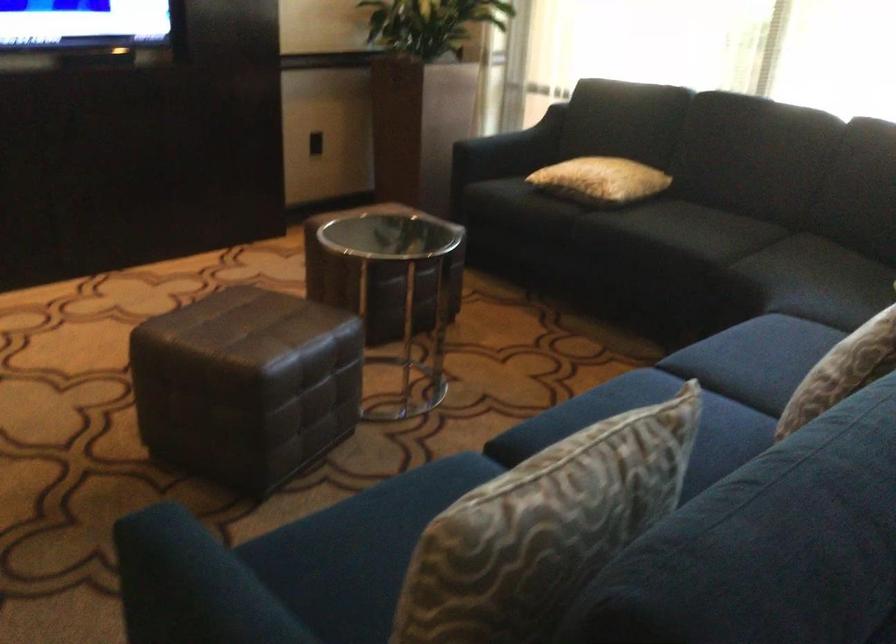
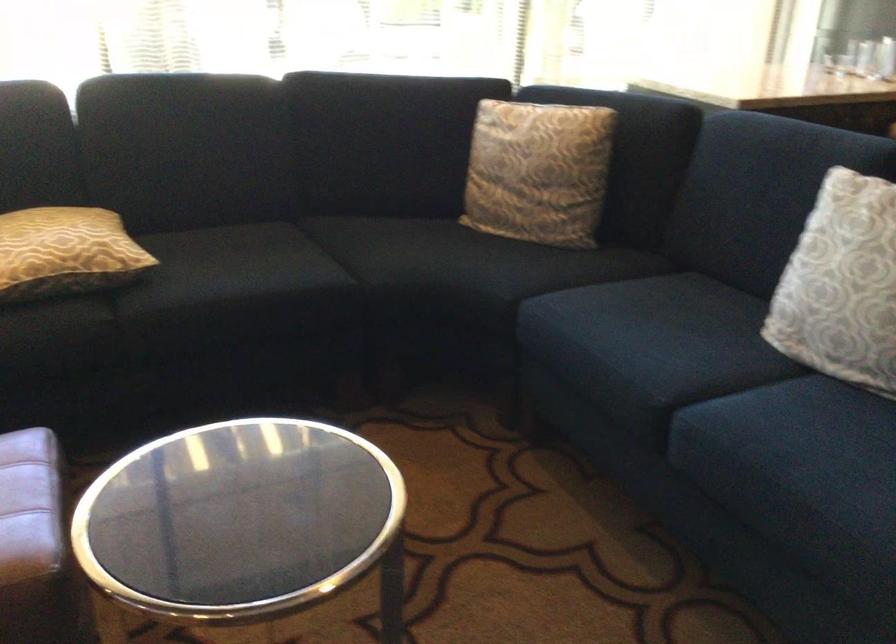
In the second image, find the point that corresponds to [771,263] in the first image.

(391, 261)